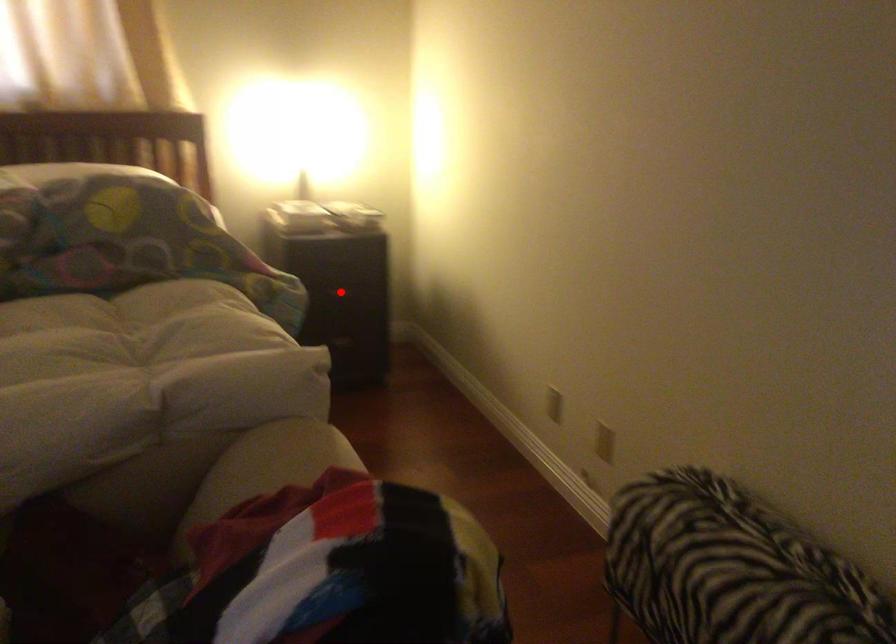
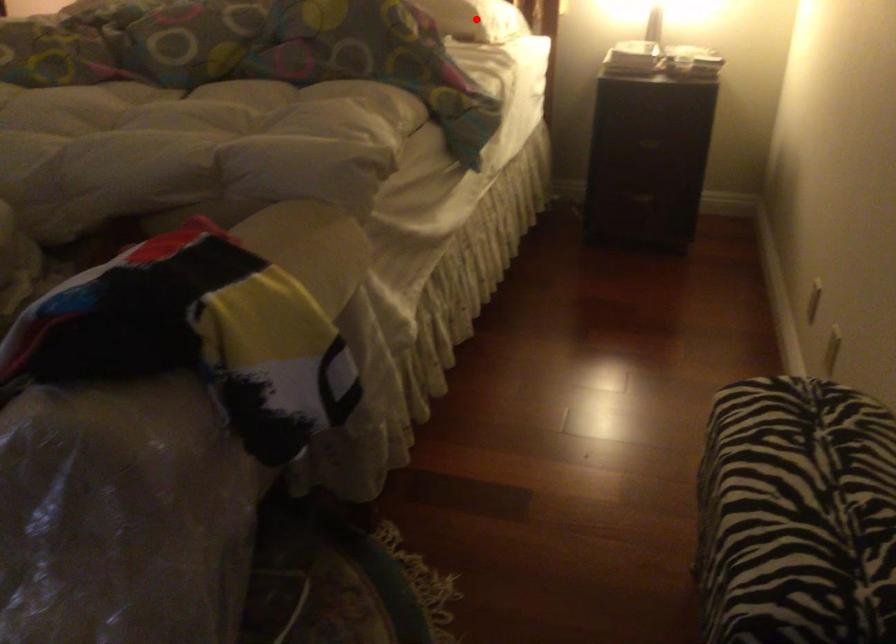
I am providing you with two images of the same scene from different viewpoints. A red point is marked on the first image and another point is marked on the second image. Is the red point in image1 aligned with the point shown in image2?

No